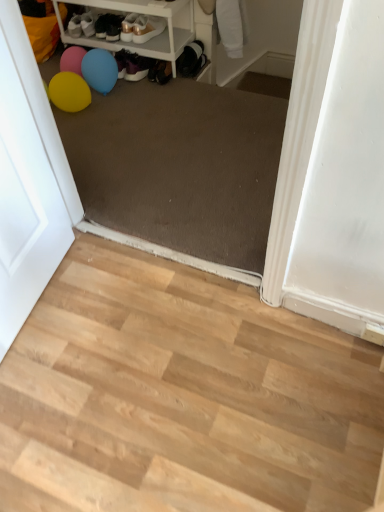
Identify the location of free region under matte white screen door at left (from a real-world perspective). (43, 308).